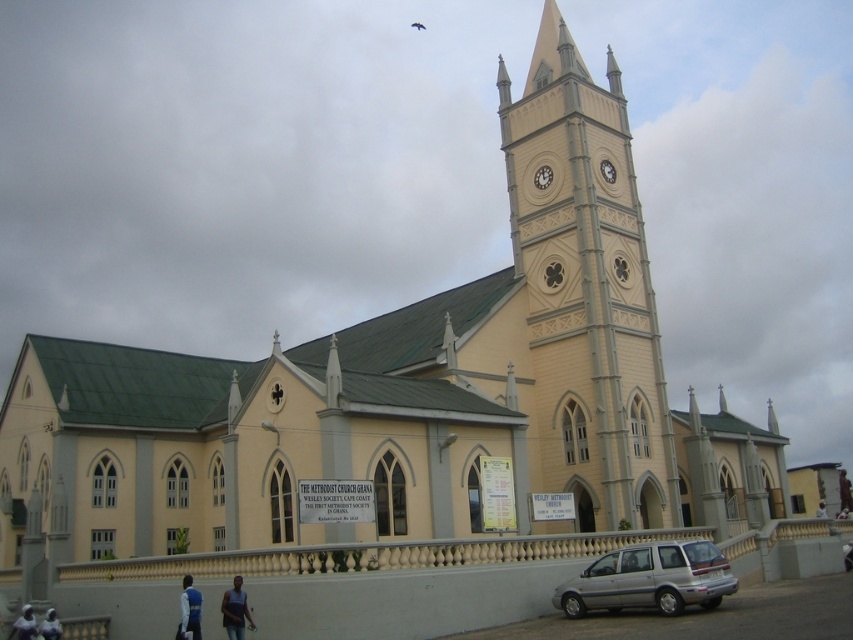
You are standing in front of the Methodist Church Ghana and notice a blue fabric jacket at lower left and a dark skin human at upper center. Which object appears narrower in the image?

The blue fabric jacket at lower left has a lesser width compared to the dark skin human at upper center, so it appears narrower.